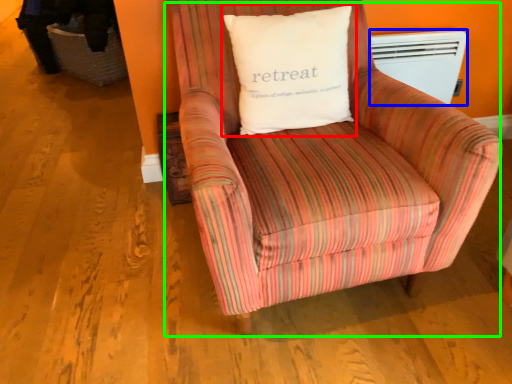
Question: Estimate the real-world distances between objects in this image. Which object is closer to pillow (highlighted by a red box), heater (highlighted by a blue box) or chair (highlighted by a green box)?

Choices:
 (A) heater
 (B) chair

Answer: (B)